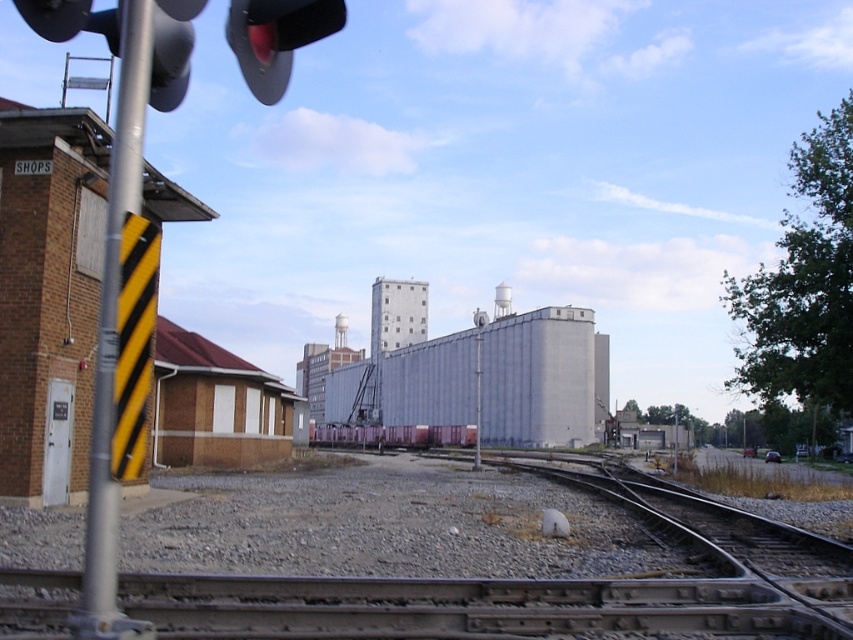
You are a pedestrian waiting at the railway crossing. You see the smooth metal train track at center and the black matte traffic light at upper center. Which object is closer to the ground?

The smooth metal train track at center is closer to the ground since it is positioned below the black matte traffic light at upper center.

You are standing at the railway crossing and see two points marked on the ground. The first point is at coordinates point (653, 528) and the second point is at point (270, 35). Which point is closer to your current position?

Point (270, 35) is closer to your current position because it is closer to the camera than point (653, 528).